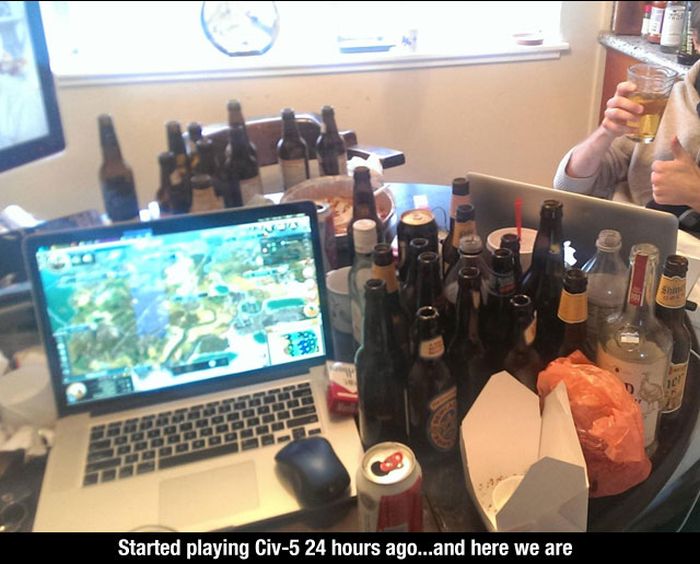
Find the location of a particular element. wall is located at coordinates (472, 120).